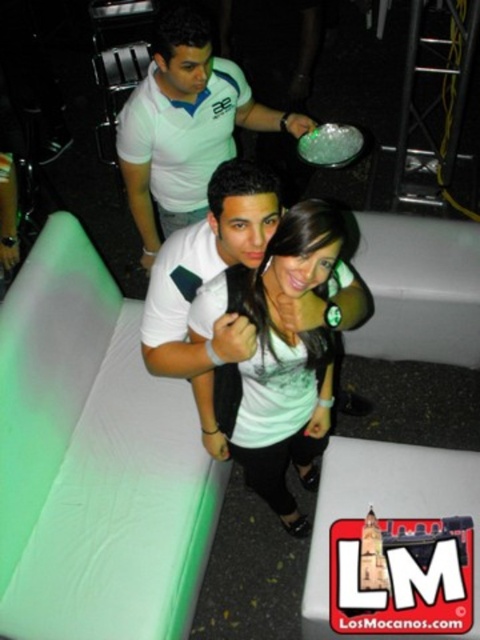
You are at a party and want to take a photo of two specific points in the scene. The first point is at coordinates point (213,316) and the second is at point (134,196). Which point should you focus on first if you want to capture both in a single shot without moving the camera?

Point (213,316) is closer to the viewer than point (134,196), so you should focus on point (213,316) first to ensure both points are in focus.